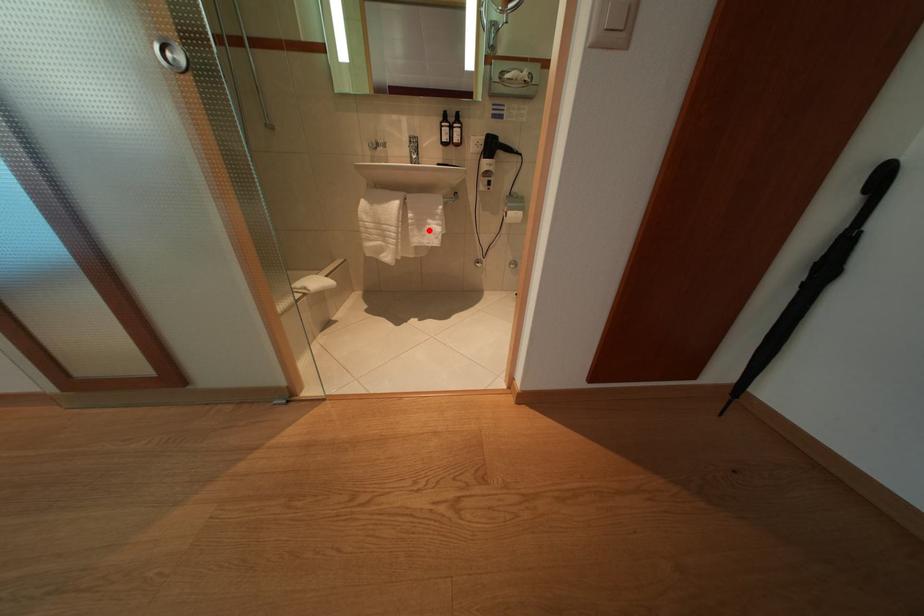
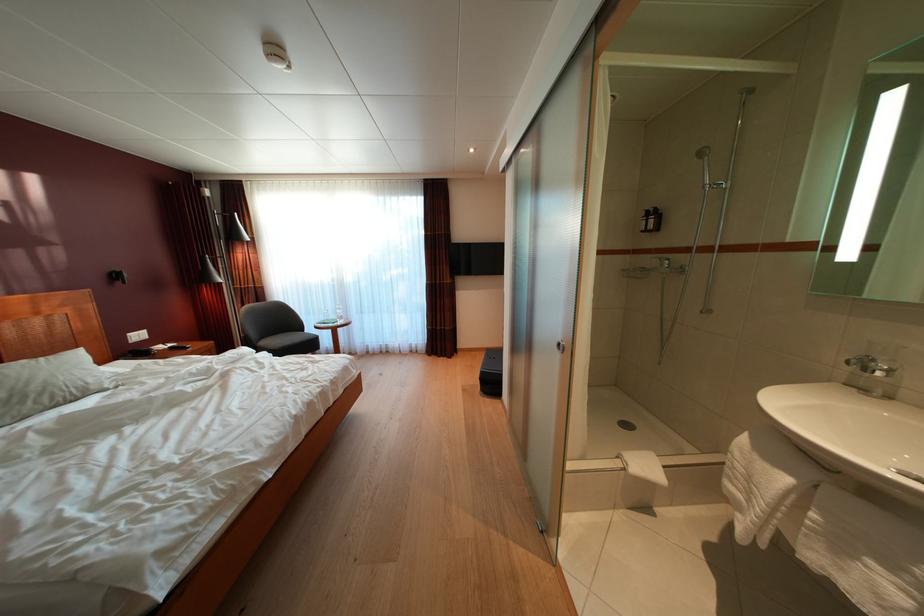
The point at the highlighted location is marked in the first image. Where is the corresponding point in the second image?

(849, 554)